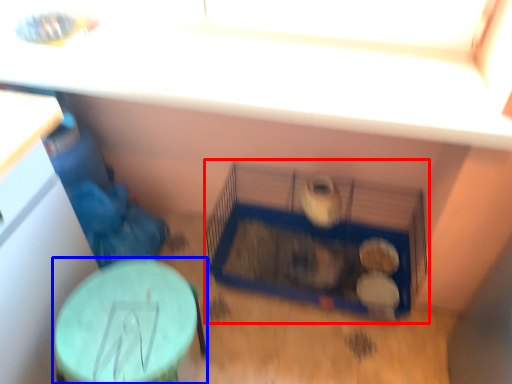
Question: Which of the following is the farthest to the observer, bird cage (highlighted by a red box) or table (highlighted by a blue box)?

Choices:
 (A) bird cage
 (B) table

Answer: (A)